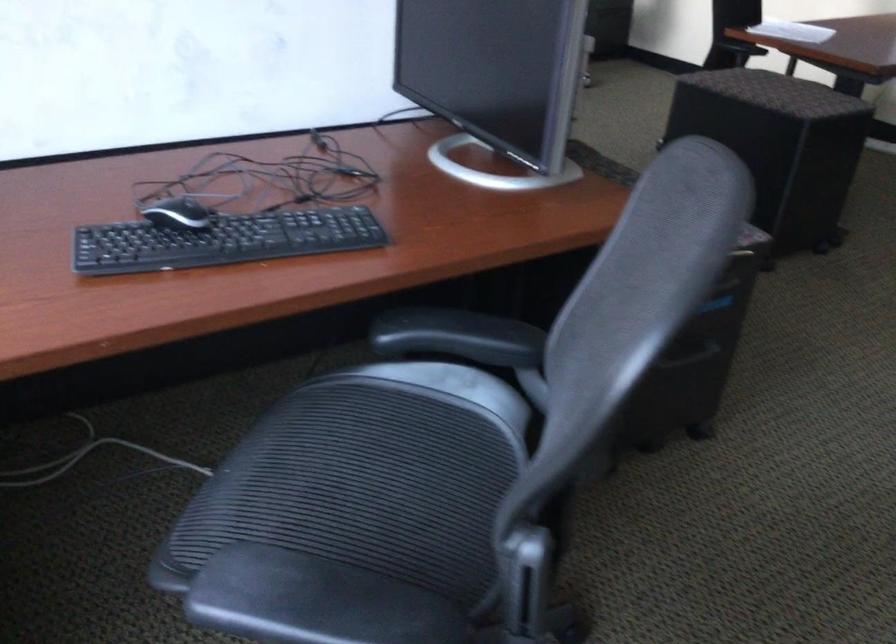
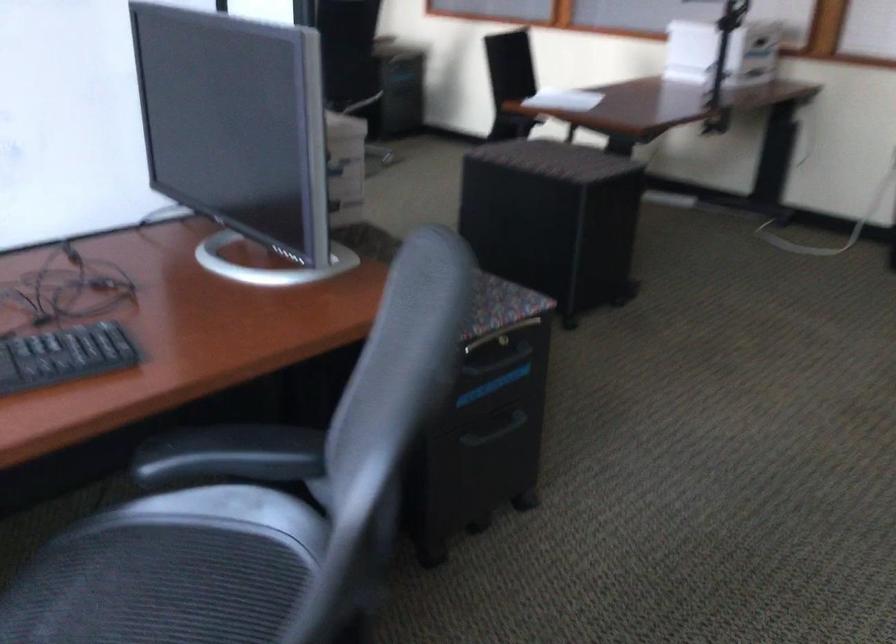
Question: Based on the continuous images, in which direction is the camera rotating? Reply with the corresponding letter.

Choices:
 (A) Left
 (B) Right
 (C) Up
 (D) Down

Answer: (B)